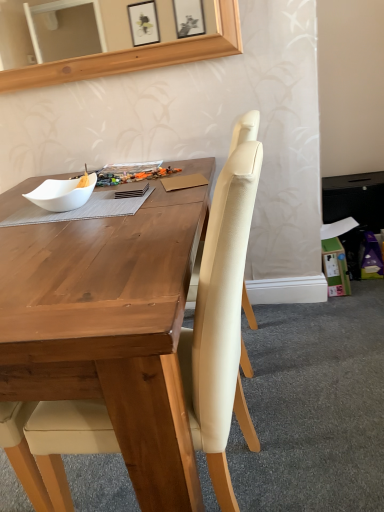
You are a GUI agent. You are given a task and a screenshot of the screen. Output one action in this format:
    pyautogui.click(x=<x>, y=<y>)
    Task: Click on the vacant region in front of white matte bowl at left
    
    Given the screenshot: What is the action you would take?
    pyautogui.click(x=61, y=226)